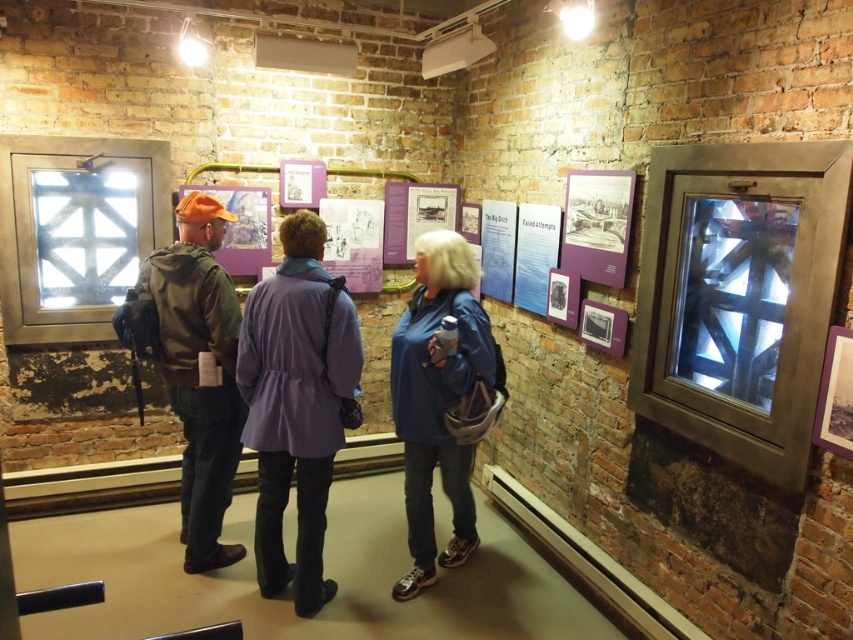
Who is higher up, blue fabric coat at center or blue fabric jacket at center?

blue fabric coat at center is higher up.

Can you confirm if blue fabric coat at center is positioned below blue fabric jacket at center?

No, blue fabric coat at center is not below blue fabric jacket at center.

Locate an element on the screen. blue fabric coat at center is located at coordinates (254, 387).

Is blue fabric coat at center closer to the viewer compared to purple fabric coat at center?

Yes.

Which is below, blue fabric coat at center or purple fabric coat at center?

purple fabric coat at center is lower down.

Is point (335, 276) farther from viewer compared to point (277, 547)?

Yes, point (335, 276) is behind point (277, 547).

Identify the location of blue fabric coat at center. The image size is (853, 640). (254, 387).

Who is more distant from viewer, [407,497] or [236,406]?

The point [236,406] is behind.

Between blue fabric jacket at center and green matte jacket at center, which one appears on the right side from the viewer's perspective?

From the viewer's perspective, blue fabric jacket at center appears more on the right side.

Find the location of a particular element. The height and width of the screenshot is (640, 853). blue fabric jacket at center is located at coordinates (442, 400).